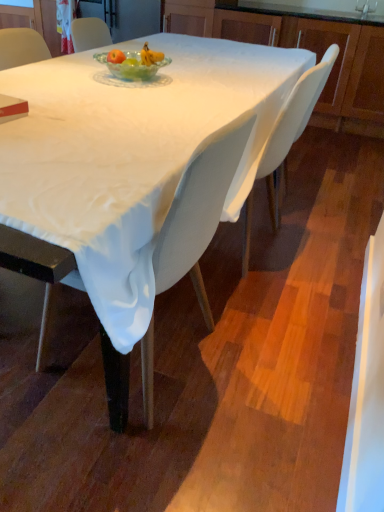
Locate an element on the screen. vacant space that is in between translucent glass bowl at center and matte red book at lower left is located at coordinates (84, 94).